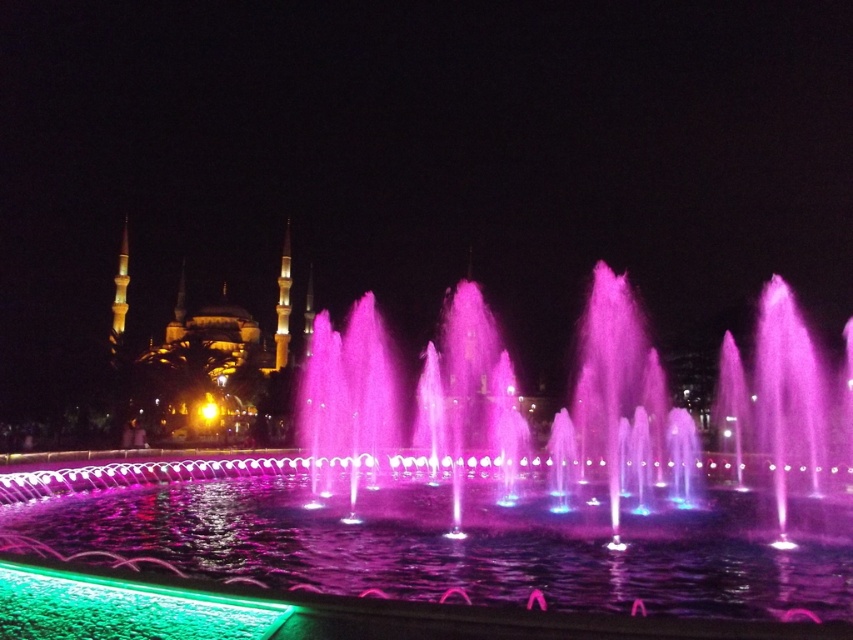
You are standing at the edge of the fountain and want to know which water jet is taller. Can you tell me which one is taller between the pink translucent water at center and the green glass water at lower left?

The pink translucent water at center has a greater height compared to the green glass water at lower left, so the pink translucent water at center is taller.

You are a maintenance worker tasked with cleaning the fountain. You have a 3 meter long pole tool. You need to reach the pink translucent water at center from the green glass water at lower left. Can you reach it with your current tool?

The distance between the pink translucent water at center and green glass water at lower left is 3.24 meters. Since the pole tool is only 3 meters long, it is 0.24 meters shorter than needed. Therefore, you cannot reach the pink translucent water at center from the green glass water at lower left with the current tool.

You are standing in front of the fountain and looking at the two points marked in the image. Which point, point (x=738, y=557) or point (x=804, y=509), is closer to you?

Point (x=738, y=557) is closer to you than point (x=804, y=509).